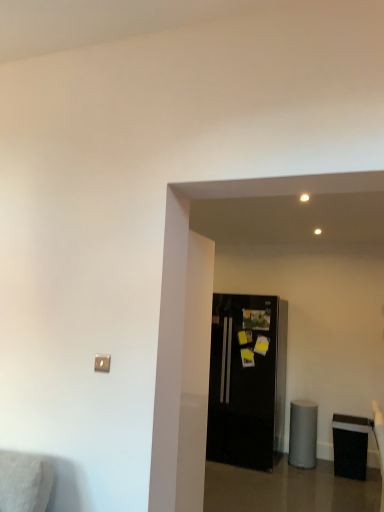
Question: Is black matte trash can at lower right in contact with black glossy refrigerator at center?

Choices:
 (A) yes
 (B) no

Answer: (B)

Question: Is black matte trash can at lower right wider than black glossy refrigerator at center?

Choices:
 (A) no
 (B) yes

Answer: (A)

Question: Considering the relative sizes of black matte trash can at lower right and black glossy refrigerator at center in the image provided, is black matte trash can at lower right taller than black glossy refrigerator at center?

Choices:
 (A) yes
 (B) no

Answer: (B)

Question: Can you confirm if black matte trash can at lower right is smaller than black glossy refrigerator at center?

Choices:
 (A) yes
 (B) no

Answer: (A)

Question: Is black matte trash can at lower right not inside black glossy refrigerator at center?

Choices:
 (A) yes
 (B) no

Answer: (A)

Question: Does black matte trash can at lower right turn towards black glossy refrigerator at center?

Choices:
 (A) no
 (B) yes

Answer: (A)

Question: Is black glossy refrigerator at center looking in the opposite direction of black matte trash can at lower right?

Choices:
 (A) no
 (B) yes

Answer: (A)

Question: Is black glossy refrigerator at center further to camera compared to black matte trash can at lower right?

Choices:
 (A) yes
 (B) no

Answer: (A)

Question: Is black glossy refrigerator at center far from black matte trash can at lower right?

Choices:
 (A) no
 (B) yes

Answer: (A)

Question: Considering the relative sizes of black glossy refrigerator at center and black matte trash can at lower right in the image provided, is black glossy refrigerator at center taller than black matte trash can at lower right?

Choices:
 (A) yes
 (B) no

Answer: (A)

Question: From the image's perspective, is black glossy refrigerator at center below black matte trash can at lower right?

Choices:
 (A) yes
 (B) no

Answer: (B)

Question: Considering the relative positions of black glossy refrigerator at center and black matte trash can at lower right in the image provided, is black glossy refrigerator at center in front of black matte trash can at lower right?

Choices:
 (A) yes
 (B) no

Answer: (B)

Question: Considering the positions of black matte trash can at lower right and black glossy refrigerator at center in the image, is black matte trash can at lower right taller or shorter than black glossy refrigerator at center?

Choices:
 (A) tall
 (B) short

Answer: (B)